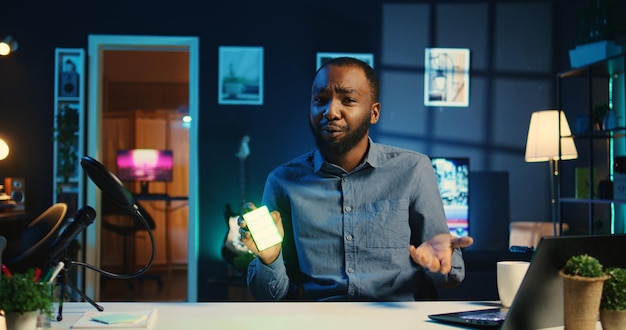
This screenshot has height=330, width=626. Find the location of `tv screens`. tv screens is located at coordinates (141, 151), (457, 175).